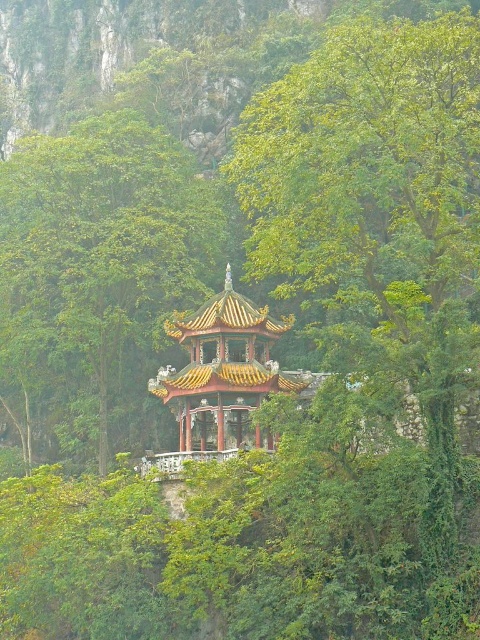
Is green leafy tree at center thinner than yellow/golden wood gazebo at center?

No.

Which is above, green leafy tree at center or yellow/golden wood gazebo at center?

green leafy tree at center is above.

Measure the distance between green leafy tree at center and camera.

79.35 meters

At what (x,y) coordinates should I click in order to perform the action: click on green leafy tree at center. Please return your answer as a coordinate pair (x, y). The image size is (480, 640). Looking at the image, I should click on (97, 282).